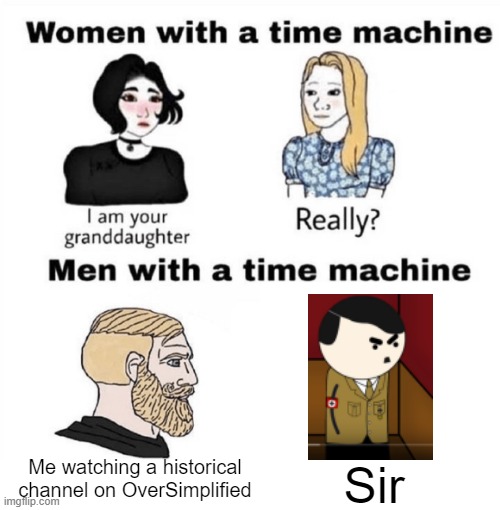
This screenshot has width=500, height=510. I want to click on art work, so click(229, 296).